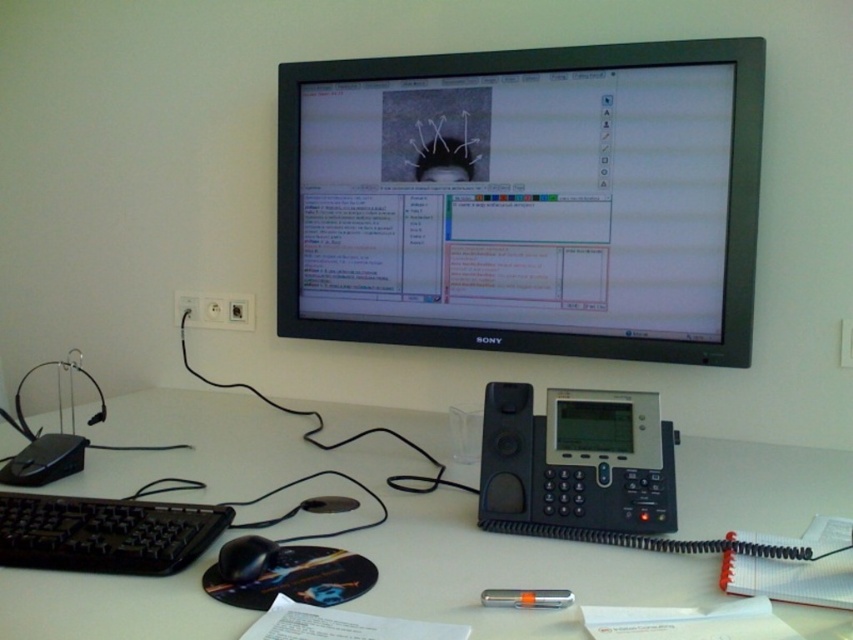
You are setting up a new workspace and need to place a metallic silver pen at center. Where should you position it relative to the black plastic speaker at center?

The metallic silver pen at center should be placed below the black plastic speaker at center since the speaker is located above it.

You are setting up a new workstation and need to place a cup of coffee between the black plastic keyboard at lower left and the black plastic speaker at center. Based on their positions, where should you place the cup so it is between them?

The black plastic keyboard at lower left is located below the black plastic speaker at center, so placing the cup of coffee between them would require positioning it above the keyboard and below the speaker.

You are setting up a workspace and need to place both the white matte table at center and the metallic silver pen at center. Considering their sizes, which object should you place first to ensure proper positioning?

The white matte table at center has a greater height compared to the metallic silver pen at center, so you should place the white matte table at center first to create a stable base for the pen.